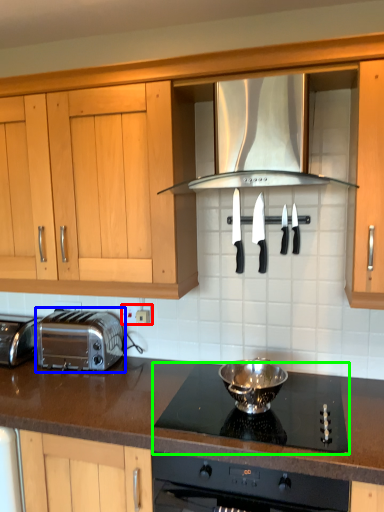
Question: Which is farther away from electric outlet (highlighted by a red box)? toaster (highlighted by a blue box) or gas stove (highlighted by a green box)?

Choices:
 (A) toaster
 (B) gas stove

Answer: (B)